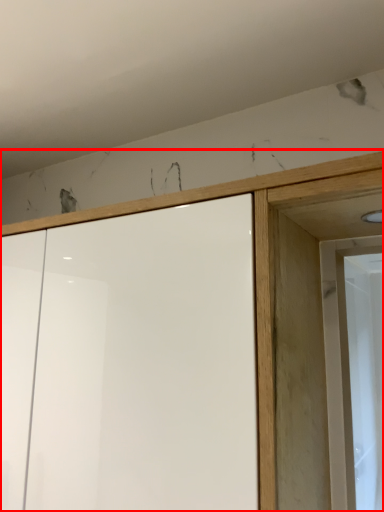
Question: From the image, what is the correct spatial relationship of cupboard (annotated by the red box) in relation to screen door?

Choices:
 (A) right
 (B) left

Answer: (B)